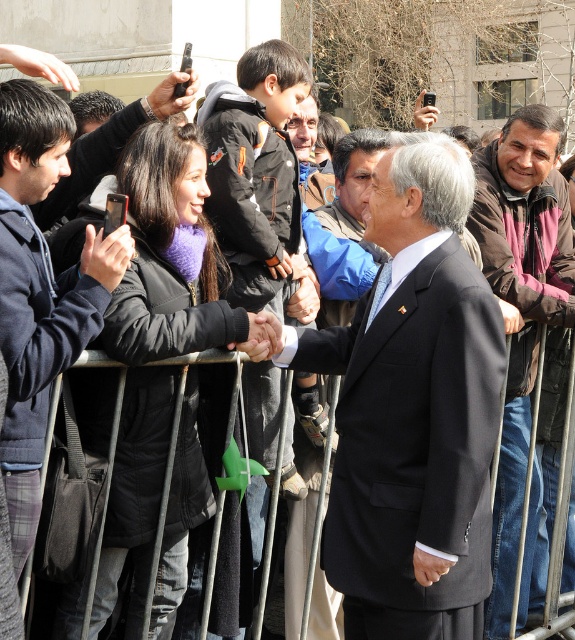
Question: Estimate the real-world distances between objects in this image. Which object is closer to the black matte suit at center?

Choices:
 (A) matte black phone at center
 (B) metallic phone at upper center
 (C) brown leather jacket at center
 (D) black plastic phone at upper center

Answer: (A)

Question: Does navy blue jacket at center appear on the left side of matte black phone at center?

Choices:
 (A) no
 (B) yes

Answer: (B)

Question: Can you confirm if black matte suit at center is thinner than metallic phone at upper center?

Choices:
 (A) yes
 (B) no

Answer: (A)

Question: Which of the following is the farthest from the observer?

Choices:
 (A) navy blue jacket at center
 (B) black plastic phone at upper center
 (C) metallic phone at upper center

Answer: (C)

Question: Which point is closer to the camera?

Choices:
 (A) black plastic phone at upper center
 (B) black matte suit at center

Answer: (B)

Question: Can you confirm if black matte suit at center is smaller than black plastic phone at upper center?

Choices:
 (A) no
 (B) yes

Answer: (A)